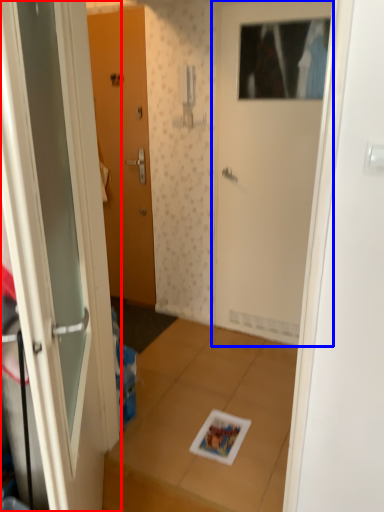
Question: Which point is closer to the camera, door (highlighted by a red box) or door (highlighted by a blue box)?

Choices:
 (A) door
 (B) door

Answer: (A)